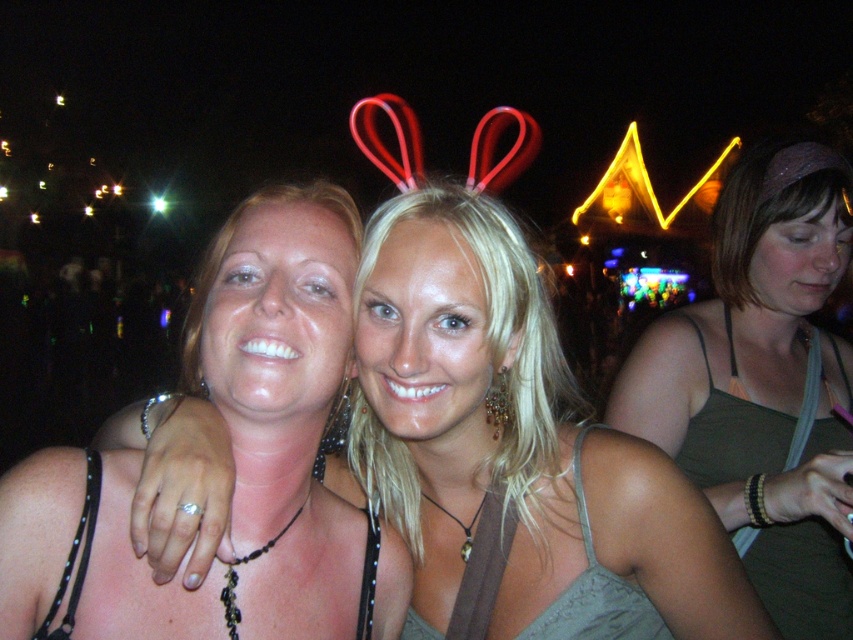
Looking at the two women in the center of the image, which one is wearing the matte black tank top at center and positioned to the left of the matte green tank top at center?

The matte black tank top at center is to the left of the matte green tank top at center.

Consider the image. You are a photographer standing in front of the scene. You want to focus your camera on the matte black tank top at center and the matte green tank top at center. Which one should you adjust your focus to first to ensure both are in sharp view?

The matte black tank top at center is closer to the viewer than the matte green tank top at center, so you should focus on the matte black tank top at center first to ensure both are in sharp view.

You are standing in the nighttime scene and need to locate the matte black tank top at center. According to the coordinates provided, where exactly is it positioned?

The matte black tank top at center is located at point 0.697 along the horizontal axis and 0.606 along the vertical axis.